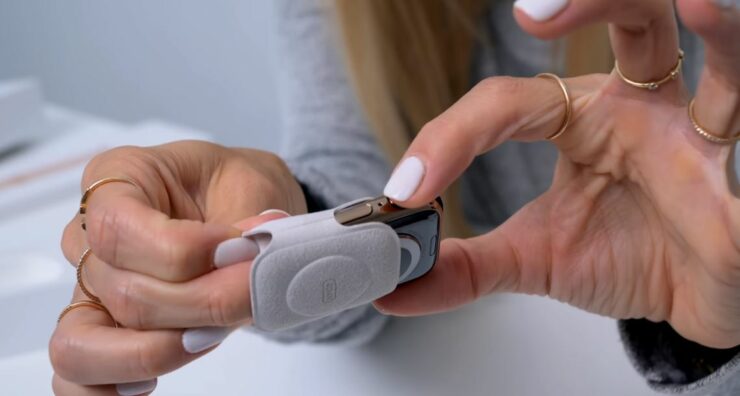
This screenshot has width=740, height=396. In order to click on felt cover in this screenshot , I will do `click(323, 279)`.